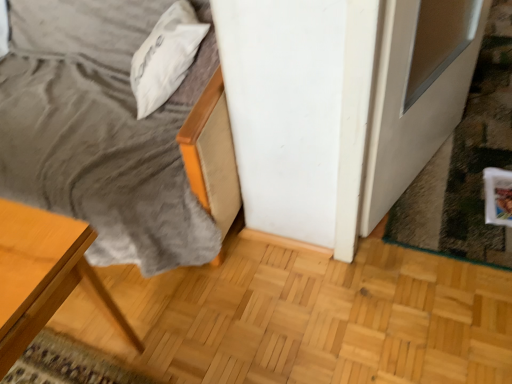
The height and width of the screenshot is (384, 512). Find the location of `spots to the right of white glossy screen door at lower right`. spots to the right of white glossy screen door at lower right is located at coordinates (475, 152).